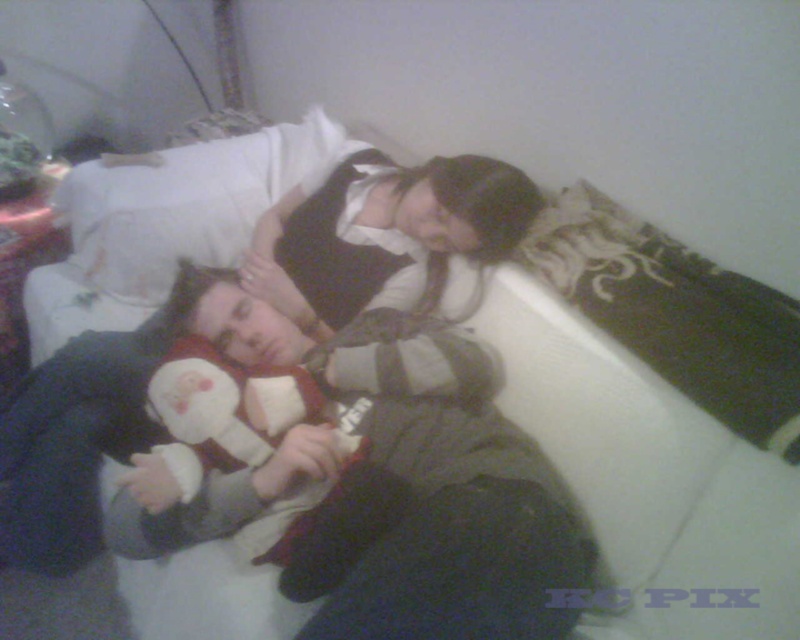
Between soft gray sweater at center and white soft pillow at upper center, which one appears on the left side from the viewer's perspective?

From the viewer's perspective, white soft pillow at upper center appears more on the left side.

Between point (509, 493) and point (141, 163), which one is positioned behind?

Point (141, 163)

I want to click on soft gray sweater at center, so click(x=416, y=483).

The width and height of the screenshot is (800, 640). I want to click on soft gray sweater at center, so click(416, 483).